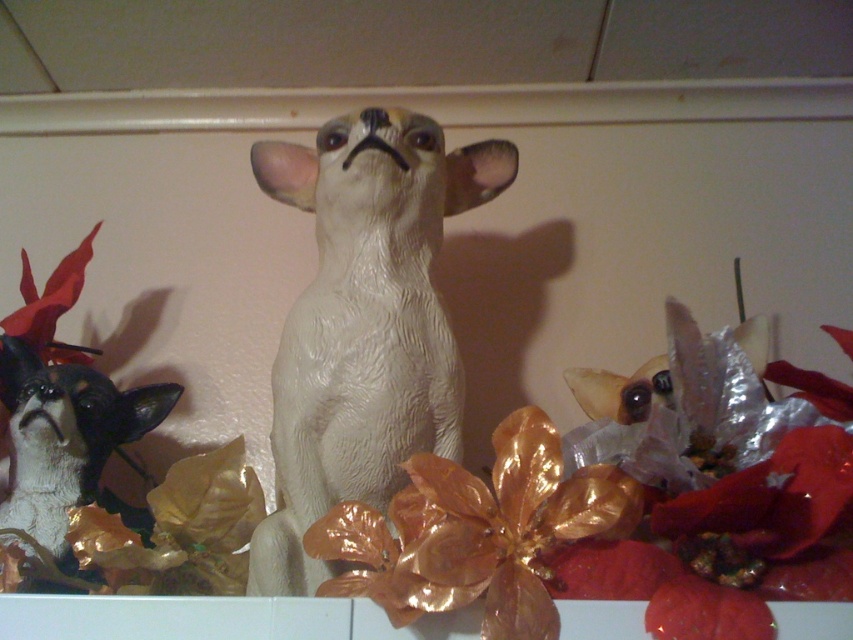
Based on the photo, is the position of white glossy dog at center less distant than that of white glossy dog at left?

Yes, it is in front of white glossy dog at left.

What do you see at coordinates (363, 323) in the screenshot?
I see `white glossy dog at center` at bounding box center [363, 323].

This screenshot has width=853, height=640. What are the coordinates of `white glossy dog at center` in the screenshot? It's located at (363, 323).